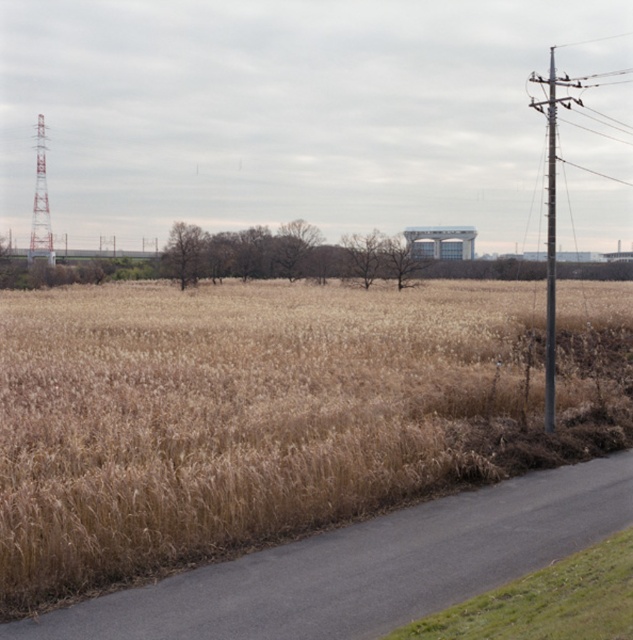
You are a photographer planning to take a picture of the metallic gray telegraph pole at right and the white painted metal tower at left. Which object should you focus on first if you want to capture both in sharp focus without changing your camera settings?

You should focus on the metallic gray telegraph pole at right first because it is closer to the viewer than the white painted metal tower at left. By focusing on the closer object, the farther one will still be within the depth of field, ensuring both are in focus.

You are a surveyor trying to determine the best location to place a new communication antenna. You have two options in the image provided. The first option is the brown grassy field at center, and the second is the white painted metal tower at left. Which location would provide a higher elevation for the antenna to ensure better signal reception?

The white painted metal tower at left is taller than the brown grassy field at center, so placing the antenna on the white painted metal tower at left would provide a higher elevation and better signal reception.